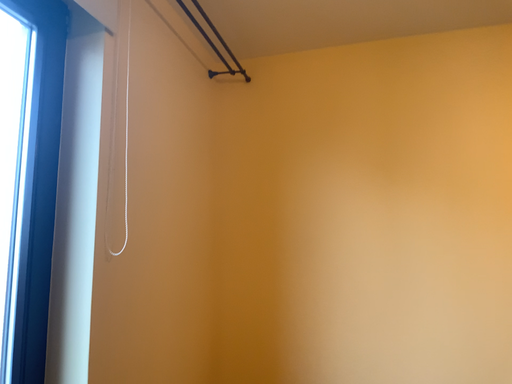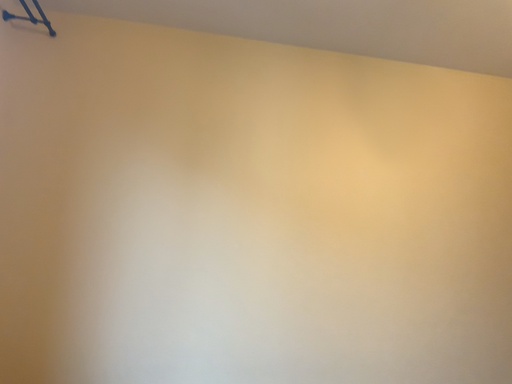
Question: How did the camera likely rotate when shooting the video?

Choices:
 (A) rotated right
 (B) rotated left

Answer: (A)